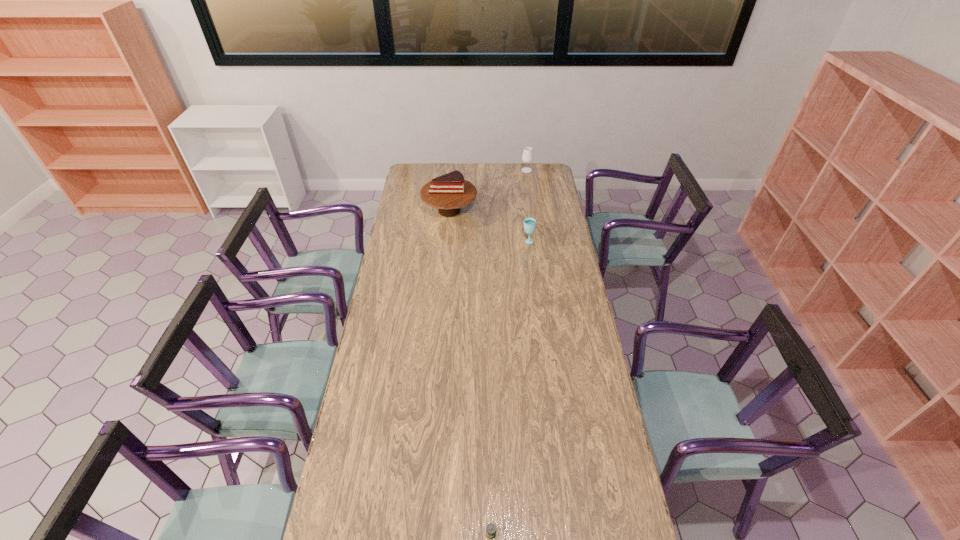
Where is `cake`? cake is located at coordinates (448, 193).

Locate an element on the screen. This screenshot has height=540, width=960. the leftmost object is located at coordinates (448, 193).

Find the location of `the farthest object`. the farthest object is located at coordinates (527, 157).

At what (x,y) coordinates should I click in order to perform the action: click on the third farthest object. Please return your answer as a coordinate pair (x, y). Looking at the image, I should click on (529, 223).

The image size is (960, 540). I want to click on vacant region located 0.360m on the back of the leftmost object, so click(x=453, y=164).

I want to click on vacant area situated 0.070m on the left of the farther glass, so click(510, 170).

You are a GUI agent. You are given a task and a screenshot of the screen. Output one action in this format:
    pyautogui.click(x=<x>, y=<y>)
    Task: Click on the free space located on the right of the nearer glass
    Image resolution: width=960 pixels, height=540 pixels.
    Given the screenshot: What is the action you would take?
    pyautogui.click(x=547, y=241)

Locate an element on the screen. object that is at the far edge is located at coordinates (527, 157).

I want to click on object that is at the left edge, so click(448, 193).

The width and height of the screenshot is (960, 540). Identify the location of object that is at the right edge. (527, 157).